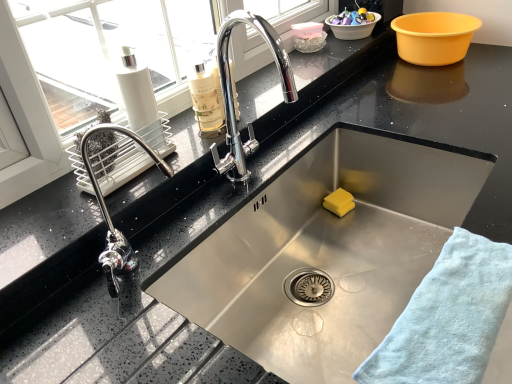
At what (x,y) coordinates should I click in order to perform the action: click on translucent plastic container at upper center, which is the 1th basin in left-to-right order. Please return your answer as a coordinate pair (x, y). This screenshot has height=384, width=512. Looking at the image, I should click on (307, 30).

This screenshot has height=384, width=512. What do you see at coordinates (434, 37) in the screenshot?
I see `yellow plastic basin at upper right, acting as the 3th basin starting from the left` at bounding box center [434, 37].

This screenshot has height=384, width=512. I want to click on yellow plastic basin at upper right, acting as the 3th basin starting from the left, so click(434, 37).

Measure the distance between point (x=331, y=196) and camera.

Point (x=331, y=196) is 1.21 meters from camera.

Measure the distance between light blue cotton towel at lower right and camera.

The distance of light blue cotton towel at lower right from camera is 51.79 centimeters.

How much space does white plastic basin at upper right, which ranks as the second basin in right-to-left order, occupy horizontally?

It is 6.36 inches.

At what (x,y) coordinates should I click in order to perform the action: click on white plastic basin at upper right, which ranks as the second basin in right-to-left order. Please return your answer as a coordinate pair (x, y). Looking at the image, I should click on (352, 29).

At what (x,y) coordinates should I click in order to perform the action: click on translucent plastic container at upper center, the third basin when ordered from right to left. Please return your answer as a coordinate pair (x, y). Image resolution: width=512 pixels, height=384 pixels. Looking at the image, I should click on (307, 30).

Is translucent plastic container at upper center, the third basin when ordered from right to left, surrounded by yellow sponge at sink bottom?

No, yellow sponge at sink bottom does not contain translucent plastic container at upper center, the third basin when ordered from right to left.

Does yellow sponge at sink bottom turn towards translucent plastic container at upper center, the third basin when ordered from right to left?

No.

Which is more distant, (343, 193) or (314, 35)?

Positioned behind is point (314, 35).

Between yellow sponge at sink bottom and translucent plastic container at upper center, which is the 1th basin in left-to-right order, which one has larger size?

yellow sponge at sink bottom.

Could you tell me if yellow plastic basin at upper right, which is counted as the 1th basin, starting from the right, is facing translucent plastic container at upper center, the third basin when ordered from right to left?

No, yellow plastic basin at upper right, which is counted as the 1th basin, starting from the right, is not turned towards translucent plastic container at upper center, the third basin when ordered from right to left.

Is yellow plastic basin at upper right, acting as the 3th basin starting from the left, taller or shorter than translucent plastic container at upper center, the third basin when ordered from right to left?

Considering their sizes, yellow plastic basin at upper right, acting as the 3th basin starting from the left, has more height than translucent plastic container at upper center, the third basin when ordered from right to left.

From a real-world perspective, starting from the translucent plastic container at upper center, the third basin when ordered from right to left, which basin is the 2nd one below it? Please provide its 2D coordinates.

[(434, 37)]

Is point (439, 54) positioned before point (303, 26)?

Yes, it is.

From a real-world perspective, is yellow sponge at sink bottom on white plastic basin at upper right, which ranks as the second basin in right-to-left order?

Incorrect, from a real-world perspective, yellow sponge at sink bottom is lower than white plastic basin at upper right, which ranks as the second basin in right-to-left order.

Locate an element on the screen. soap lying in front of the white plastic basin at upper right, which ranks as the second basin in right-to-left order is located at coordinates (339, 202).

Which of these two, yellow sponge at sink bottom or white plastic basin at upper right, the second basin viewed from the left, is thinner?

Thinner between the two is yellow sponge at sink bottom.

Does yellow sponge at sink bottom have a greater height compared to white plastic basin at upper right, the second basin viewed from the left?

Indeed, yellow sponge at sink bottom has a greater height compared to white plastic basin at upper right, the second basin viewed from the left.

Where is `soap above the light blue cotton towel at lower right (from the image's perspective)`? soap above the light blue cotton towel at lower right (from the image's perspective) is located at coordinates (339, 202).

Can you confirm if yellow sponge at sink bottom is wider than light blue cotton towel at lower right?

Incorrect, the width of yellow sponge at sink bottom does not surpass that of light blue cotton towel at lower right.

Consider the image. Can we say yellow sponge at sink bottom lies outside light blue cotton towel at lower right?

Absolutely, yellow sponge at sink bottom is external to light blue cotton towel at lower right.

Is yellow sponge at sink bottom placed right next to light blue cotton towel at lower right?

They are not placed beside each other.

Considering the positions of points (366, 26) and (127, 107), is point (366, 26) farther from camera compared to point (127, 107)?

Yes, point (366, 26) is behind point (127, 107).

Which object is further away from the camera taking this photo, white plastic basin at upper right, the second basin viewed from the left, or white matte bottle at upper left?

white plastic basin at upper right, the second basin viewed from the left, is further from the camera.

How many degrees apart are the facing directions of white plastic basin at upper right, which ranks as the second basin in right-to-left order, and white matte bottle at upper left?

The angular difference between white plastic basin at upper right, which ranks as the second basin in right-to-left order, and white matte bottle at upper left is 0.000827 degrees.

In terms of width, does white plastic basin at upper right, which ranks as the second basin in right-to-left order, look wider or thinner when compared to white matte bottle at upper left?

In the image, white plastic basin at upper right, which ranks as the second basin in right-to-left order, appears to be wider than white matte bottle at upper left.

Considering the sizes of objects translucent plastic container at upper center, which is the 1th basin in left-to-right order, and yellow plastic basin at upper right, acting as the 3th basin starting from the left, in the image provided, who is shorter, translucent plastic container at upper center, which is the 1th basin in left-to-right order, or yellow plastic basin at upper right, acting as the 3th basin starting from the left,?

translucent plastic container at upper center, which is the 1th basin in left-to-right order.

Looking at this image, from a real-world perspective, relative to yellow plastic basin at upper right, which is counted as the 1th basin, starting from the right, is translucent plastic container at upper center, the third basin when ordered from right to left, vertically above or below?

Clearly, from a real-world perspective, translucent plastic container at upper center, the third basin when ordered from right to left, is above yellow plastic basin at upper right, which is counted as the 1th basin, starting from the right.

Between translucent plastic container at upper center, the third basin when ordered from right to left, and yellow plastic basin at upper right, acting as the 3th basin starting from the left, which one has larger size?

With larger size is yellow plastic basin at upper right, acting as the 3th basin starting from the left.

Which is farther from the camera, (303, 27) or (440, 64)?

The point (303, 27) is behind.

Is white matte bottle at upper left outside of light blue cotton towel at lower right?

white matte bottle at upper left is positioned outside light blue cotton towel at lower right.

Is white matte bottle at upper left at the right side of light blue cotton towel at lower right?

No.

Is white matte bottle at upper left closer to the viewer compared to light blue cotton towel at lower right?

No, it is behind light blue cotton towel at lower right.

Can you confirm if white matte bottle at upper left is smaller than light blue cotton towel at lower right?

Yes.

Find the location of a particular element. the 2nd basin behind the yellow sponge at sink bottom is located at coordinates (307, 30).

This screenshot has width=512, height=384. In order to click on the 1st basin above the yellow plastic basin at upper right, acting as the 3th basin starting from the left (from the image's perspective) in this screenshot , I will do `click(307, 30)`.

Estimate the real-world distances between objects in this image. Which object is further from yellow plastic basin at upper right, which is counted as the 1th basin, starting from the right, yellow sponge at sink bottom or light blue cotton towel at lower right?

Based on the image, light blue cotton towel at lower right appears to be further to yellow plastic basin at upper right, which is counted as the 1th basin, starting from the right.

Which object lies nearer to the anchor point light blue cotton towel at lower right, translucent plastic container at upper center, which is the 1th basin in left-to-right order, or white plastic basin at upper right, the second basin viewed from the left?

Among the two, translucent plastic container at upper center, which is the 1th basin in left-to-right order, is located nearer to light blue cotton towel at lower right.

Considering their positions, is white plastic basin at upper right, which ranks as the second basin in right-to-left order, positioned closer to translucent plastic container at upper center, the third basin when ordered from right to left, than yellow plastic basin at upper right, acting as the 3th basin starting from the left?

white plastic basin at upper right, which ranks as the second basin in right-to-left order.

Looking at the image, which one is located further to light blue cotton towel at lower right, white plastic basin at upper right, the second basin viewed from the left, or translucent plastic container at upper center, the third basin when ordered from right to left?

white plastic basin at upper right, the second basin viewed from the left, lies further to light blue cotton towel at lower right than the other object.

Based on their spatial positions, is translucent plastic container at upper center, which is the 1th basin in left-to-right order, or white plastic basin at upper right, the second basin viewed from the left, further from yellow sponge at sink bottom?

white plastic basin at upper right, the second basin viewed from the left, lies further to yellow sponge at sink bottom than the other object.

From the image, which object appears to be farther from white matte bottle at upper left, translucent plastic container at upper center, which is the 1th basin in left-to-right order, or light blue cotton towel at lower right?

translucent plastic container at upper center, which is the 1th basin in left-to-right order.

Estimate the real-world distances between objects in this image. Which object is closer to yellow sponge at sink bottom, translucent plastic container at upper center, the third basin when ordered from right to left, or white matte bottle at upper left?

translucent plastic container at upper center, the third basin when ordered from right to left, lies closer to yellow sponge at sink bottom than the other object.

When comparing their distances from light blue cotton towel at lower right, does yellow plastic basin at upper right, which is counted as the 1th basin, starting from the right, or white matte bottle at upper left seem closer?

Based on the image, white matte bottle at upper left appears to be nearer to light blue cotton towel at lower right.

Where is `cleaning product located between light blue cotton towel at lower right and yellow sponge at sink bottom in the depth direction`? The width and height of the screenshot is (512, 384). cleaning product located between light blue cotton towel at lower right and yellow sponge at sink bottom in the depth direction is located at coordinates (139, 99).

Where is `soap between light blue cotton towel at lower right and yellow plastic basin at upper right, acting as the 3th basin starting from the left, from front to back`? This screenshot has height=384, width=512. soap between light blue cotton towel at lower right and yellow plastic basin at upper right, acting as the 3th basin starting from the left, from front to back is located at coordinates (339, 202).

You are a GUI agent. You are given a task and a screenshot of the screen. Output one action in this format:
    pyautogui.click(x=<x>, y=<y>)
    Task: Click on the cleaning product between translucent plastic container at upper center, the third basin when ordered from right to left, and yellow sponge at sink bottom vertically
    
    Given the screenshot: What is the action you would take?
    pyautogui.click(x=139, y=99)

Where is `basin between light blue cotton towel at lower right and translucent plastic container at upper center, which is the 1th basin in left-to-right order, from front to back`? The height and width of the screenshot is (384, 512). basin between light blue cotton towel at lower right and translucent plastic container at upper center, which is the 1th basin in left-to-right order, from front to back is located at coordinates (434, 37).